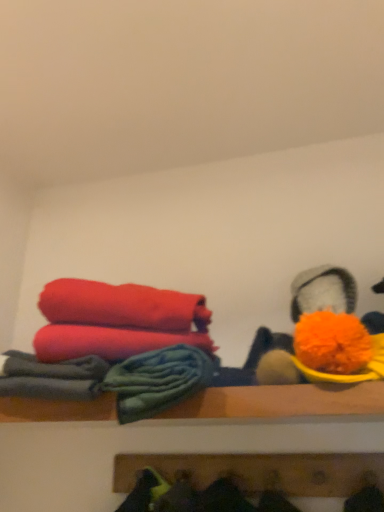
You are a GUI agent. You are given a task and a screenshot of the screen. Output one action in this format:
    pyautogui.click(x=<x>, y=<y>)
    Task: Click on the blank space above wooden coat rack at lower center, placed as the 1th shelf when sorted from bottom to top (from a real-world perspective)
    The width and height of the screenshot is (384, 512).
    Given the screenshot: What is the action you would take?
    pyautogui.click(x=251, y=442)